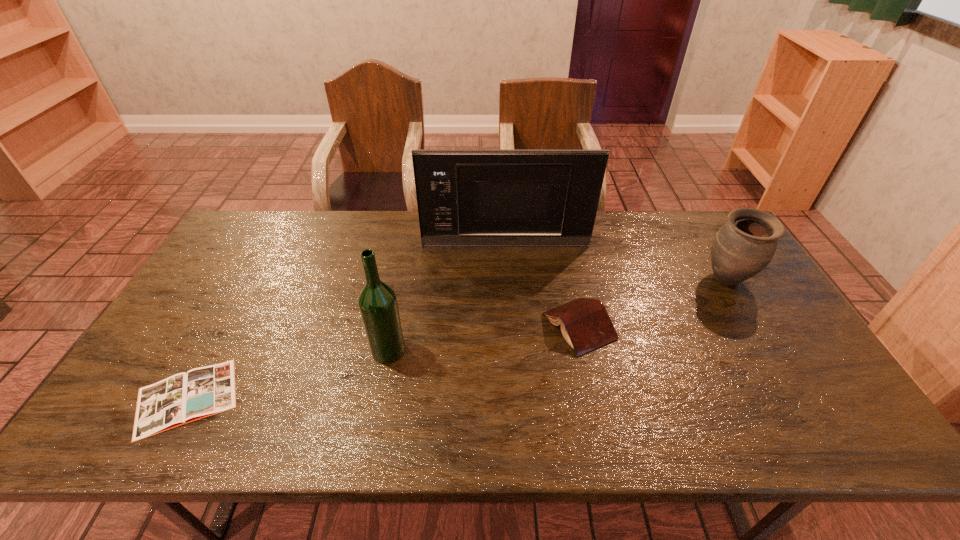
In the image, there is a desktop. At what (x,y) coordinates should I click in order to perform the action: click on blank space at the left edge. Please return your answer as a coordinate pair (x, y). Looking at the image, I should click on (208, 361).

At what (x,y) coordinates should I click in order to perform the action: click on free space at the far left corner. Please return your answer as a coordinate pair (x, y). Looking at the image, I should click on (272, 218).

Identify the location of blank space at the near right corner. (822, 416).

Image resolution: width=960 pixels, height=540 pixels. In order to click on free space between the alcohol and the leftmost object in this screenshot , I will do `click(288, 374)`.

Locate an element on the screen. The height and width of the screenshot is (540, 960). free space between the alcohol and the farthest object is located at coordinates (447, 298).

The width and height of the screenshot is (960, 540). What are the coordinates of `free space that is in between the microwave oven and the taller book` in the screenshot? It's located at (542, 286).

The image size is (960, 540). I want to click on free space that is in between the microwave oven and the farther book, so click(x=542, y=286).

You are a GUI agent. You are given a task and a screenshot of the screen. Output one action in this format:
    pyautogui.click(x=<x>, y=<y>)
    Task: Click on the blank region between the farthest object and the alcohol
    This screenshot has width=960, height=540.
    Given the screenshot: What is the action you would take?
    pyautogui.click(x=447, y=298)

You are a GUI agent. You are given a task and a screenshot of the screen. Output one action in this format:
    pyautogui.click(x=<x>, y=<y>)
    Task: Click on the empty space between the alcohol and the second shortest object
    
    Given the screenshot: What is the action you would take?
    pyautogui.click(x=484, y=338)

At what (x,y) coordinates should I click in order to perform the action: click on empty space that is in between the urn and the farther book. Please return your answer as a coordinate pair (x, y). This screenshot has width=960, height=540. Looking at the image, I should click on (653, 303).